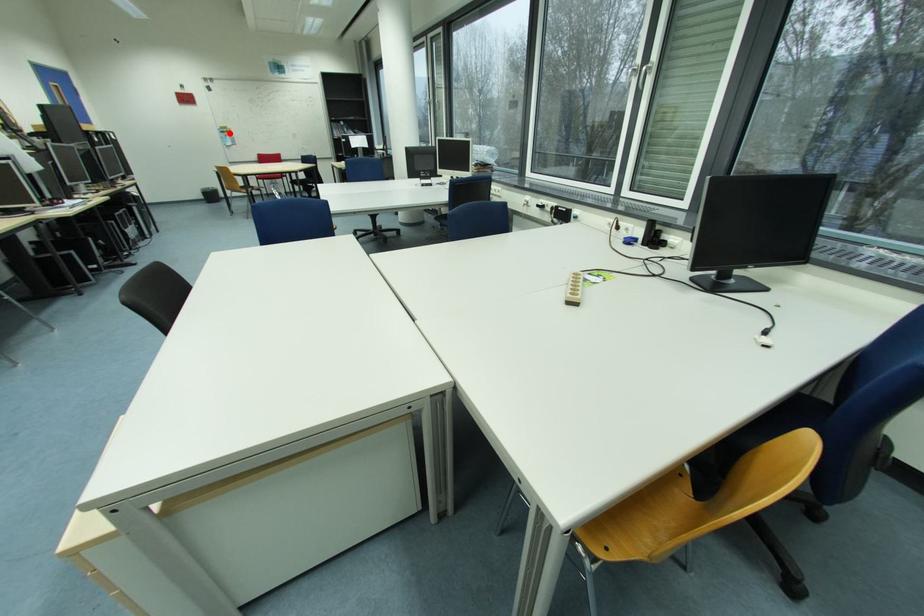
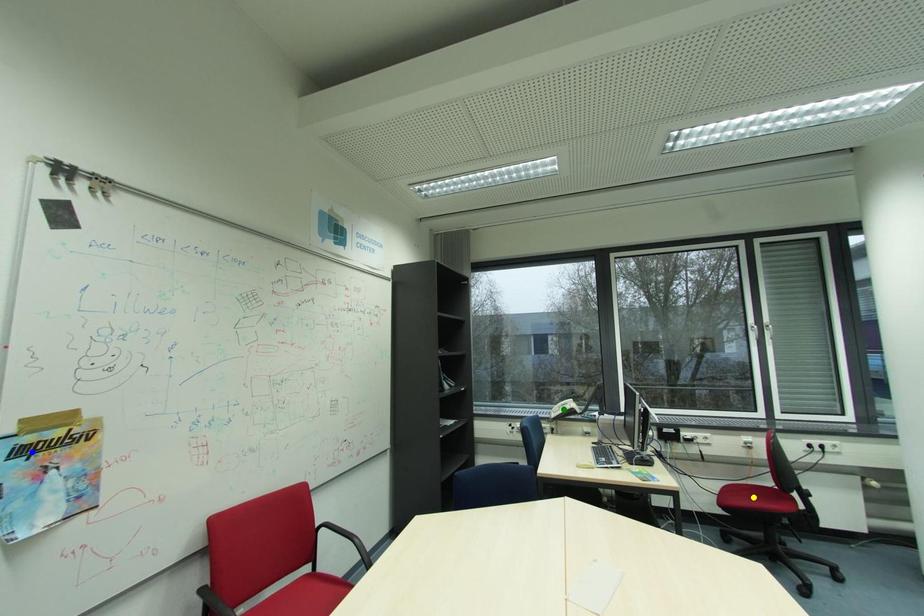
Question: I am providing you with two images of the same scene from different viewpoints. A red point is marked on the first image. You are given multiple points on the second image. Can you choose the point in image 2 that corresponds to the point in image 1?

Choices:
 (A) yellow point
 (B) blue point
 (C) green point

Answer: (B)